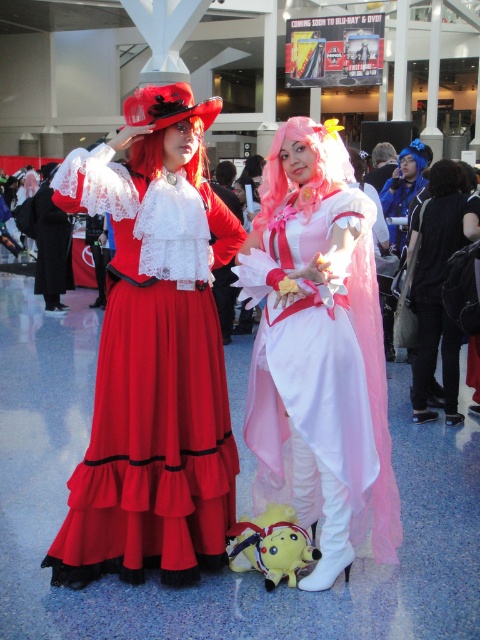
Question: Which point is closer to the camera taking this photo?

Choices:
 (A) (310, 128)
 (B) (250, 531)
 (C) (202, 486)
 (D) (141, 170)

Answer: (A)

Question: Is matte pink tulle dress at center closer to camera compared to red velvet wig at center?

Choices:
 (A) yes
 (B) no

Answer: (A)

Question: Which of the following is the farthest from the observer?

Choices:
 (A) (243, 257)
 (B) (152, 168)
 (C) (276, 177)

Answer: (C)

Question: Does matte pink tulle dress at center come behind red velvet wig at center?

Choices:
 (A) no
 (B) yes

Answer: (A)

Question: Which point is closer to the camera?

Choices:
 (A) (276, 144)
 (B) (237, 566)
 (C) (381, 324)
 (D) (118, 244)

Answer: (A)

Question: Is matte pink tulle dress at center below red velvet wig at center?

Choices:
 (A) no
 (B) yes

Answer: (B)